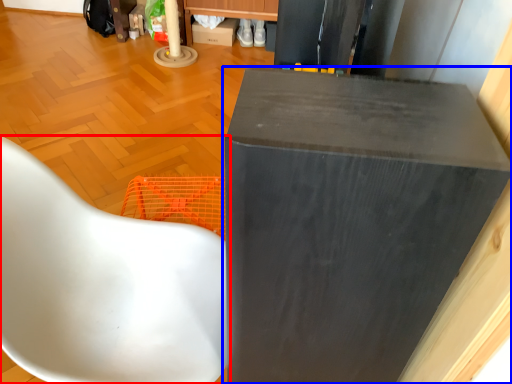
Question: Which object appears farthest to the camera in this image, chair (highlighted by a red box) or furniture (highlighted by a blue box)?

Choices:
 (A) chair
 (B) furniture

Answer: (A)